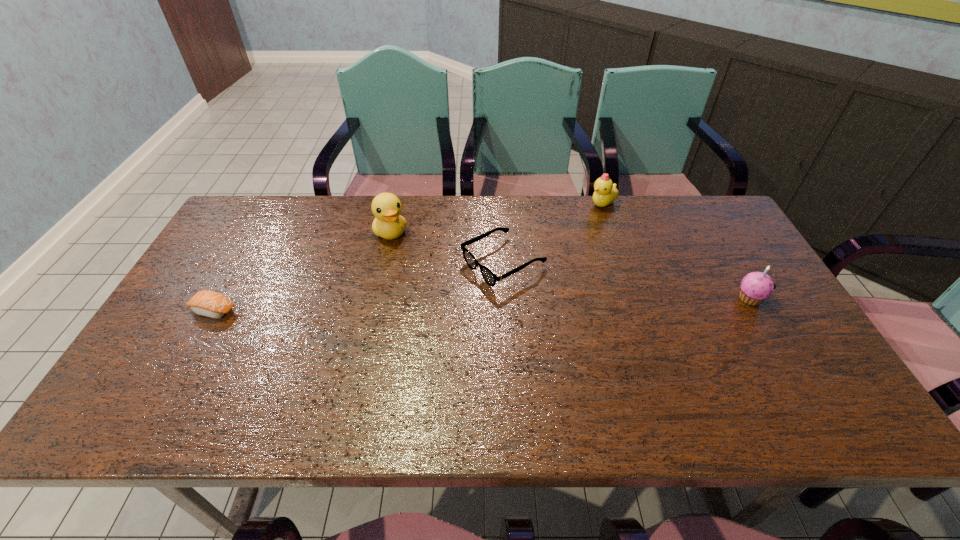
At what (x,y) coordinates should I click in order to perform the action: click on blank region between the duck and the cupcake. Please return your answer as a coordinate pair (x, y). Image resolution: width=960 pixels, height=540 pixels. Looking at the image, I should click on (570, 265).

Identify the location of free space between the cupcake and the leftmost object. The width and height of the screenshot is (960, 540). (481, 305).

The image size is (960, 540). Identify the location of blank region between the cupcake and the fourth object from right to left. pos(570,265).

Locate an element on the screen. vacant point located between the spectacles and the leftmost object is located at coordinates (358, 287).

At what (x,y) coordinates should I click in order to perform the action: click on vacant space that is in between the spectacles and the farthest object. Please return your answer as a coordinate pair (x, y). Looking at the image, I should click on (553, 233).

I want to click on free space that is in between the farthest object and the sushi, so click(408, 257).

At what (x,y) coordinates should I click in order to perform the action: click on unoccupied area between the shortest object and the third object from left to right. Please return your answer as a coordinate pair (x, y). Image resolution: width=960 pixels, height=540 pixels. Looking at the image, I should click on (358, 287).

What are the coordinates of `free space between the cupcake and the third object from right to left` in the screenshot? It's located at (626, 281).

You are a GUI agent. You are given a task and a screenshot of the screen. Output one action in this format:
    pyautogui.click(x=<x>, y=<y>)
    Task: Click on the unoccupied position between the sushi and the rightmost object
    
    Given the screenshot: What is the action you would take?
    pyautogui.click(x=481, y=305)

Select which object is the fourth closest to the farthest object. Please provide its 2D coordinates. Your answer should be formatted as a tuple, i.e. [(x, y)], where the tuple contains the x and y coordinates of a point satisfying the conditions above.

[(207, 303)]